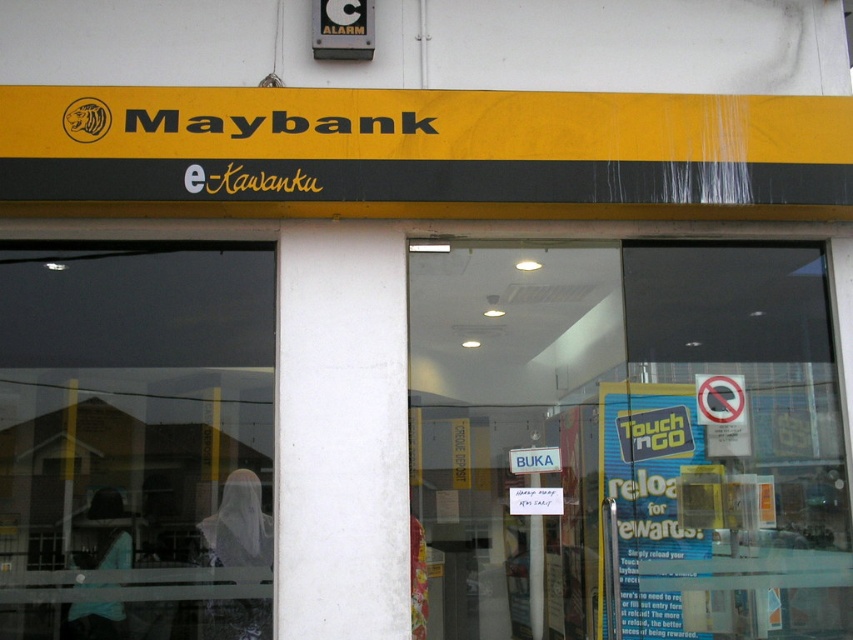
Question: Does transparent glass door at center have a greater width compared to transparent glass at left?

Choices:
 (A) yes
 (B) no

Answer: (A)

Question: Which of the following is the farthest from the observer?

Choices:
 (A) (36, 250)
 (B) (825, 304)

Answer: (B)

Question: Is transparent glass door at center bigger than transparent glass at left?

Choices:
 (A) no
 (B) yes

Answer: (B)

Question: Considering the relative positions of transparent glass door at center and transparent glass at left in the image provided, where is transparent glass door at center located with respect to transparent glass at left?

Choices:
 (A) above
 (B) below

Answer: (B)

Question: Which object appears closest to the camera in this image?

Choices:
 (A) transparent glass door at center
 (B) transparent glass at left

Answer: (B)